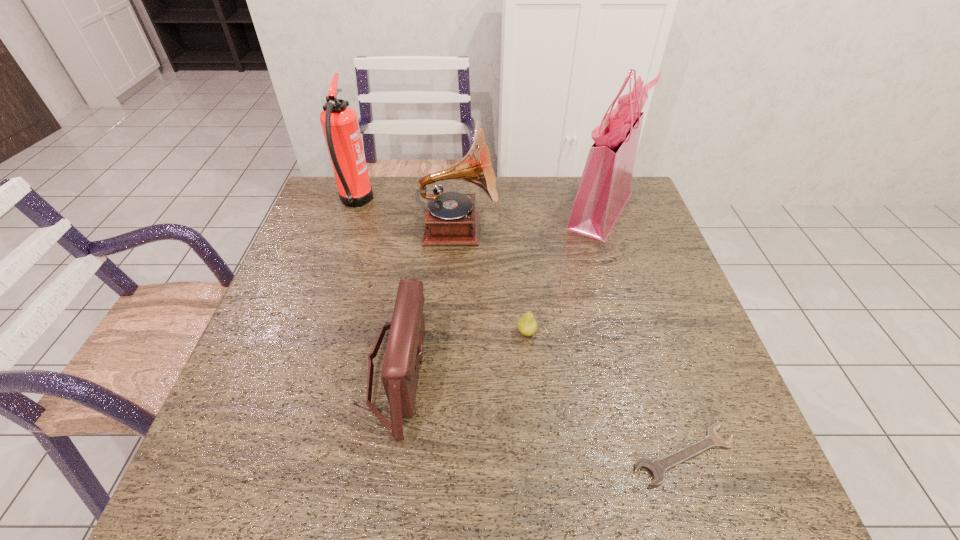
What are the coordinates of `shopping bag` in the screenshot? It's located at (605, 186).

This screenshot has width=960, height=540. I want to click on the leftmost object, so coord(339,122).

Locate an element on the screen. This screenshot has width=960, height=540. phonograph_record is located at coordinates (450, 218).

Find the location of a particular element. The image size is (960, 540). the third shortest object is located at coordinates pyautogui.click(x=404, y=351).

Identify the location of pear. Image resolution: width=960 pixels, height=540 pixels. (527, 325).

Find the location of a particular element. the third object from right to left is located at coordinates (527, 325).

Where is `wrench`? This screenshot has height=540, width=960. wrench is located at coordinates (657, 467).

Locate an element on the screen. This screenshot has width=960, height=540. vacant space located 0.170m on the left of the shopping bag is located at coordinates (507, 210).

Where is `vacant area located 0.400m at the nozzle of the fire extinguisher`? vacant area located 0.400m at the nozzle of the fire extinguisher is located at coordinates (497, 202).

You are a GUI agent. You are given a task and a screenshot of the screen. Output one action in this format:
    pyautogui.click(x=<x>, y=<y>)
    Task: Click on the blank area located on the horn of the phonograph_record
    The image size is (960, 540).
    Given the screenshot: What is the action you would take?
    pyautogui.click(x=605, y=229)